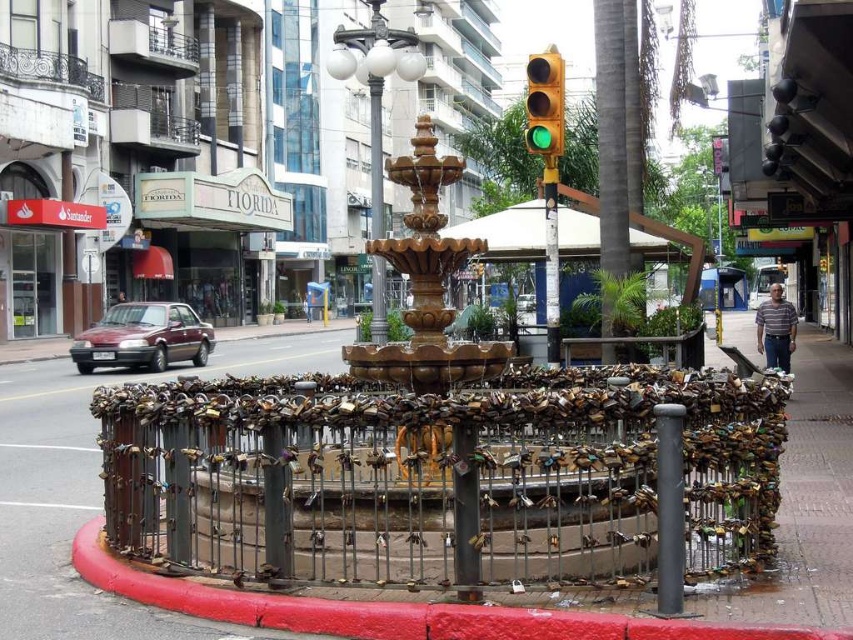
You are a city planner reviewing this area and need to place a new bench. The bench requires a 1.5 meter clearance from any object. Is the point at coordinates point [426,284] suitable for placing the bench?

The golden polished fountain at center is located at point [426,284]. Since the bench requires 1.5 meters of clearance from any object and the fountain is exactly at that point, placing the bench there would mean it is too close to the fountain. Therefore, the point is not suitable.

You are a city planner assessing the placement of street furniture. You need to ensure that all objects are proportionate to their typical sizes. Given the scene, does the metallic gray pole at center and the green glass traffic light at upper center meet standard size expectations based on their positions?

The metallic gray pole at center has a smaller size compared to the green glass traffic light at upper center. Since traffic lights are typically smaller than support poles, this arrangement does not align with standard size expectations as the traffic light appears larger than usual.

Consider the image. You are a city planner analyzing the layout of this street corner. You need to determine the relative positioning of the golden polished fountain at center and the green glass traffic light at upper center for pedestrian navigation. Which object is located to the left of the other?

The golden polished fountain at center is positioned on the left side of green glass traffic light at upper center, so the fountain is to the left of the traffic light.